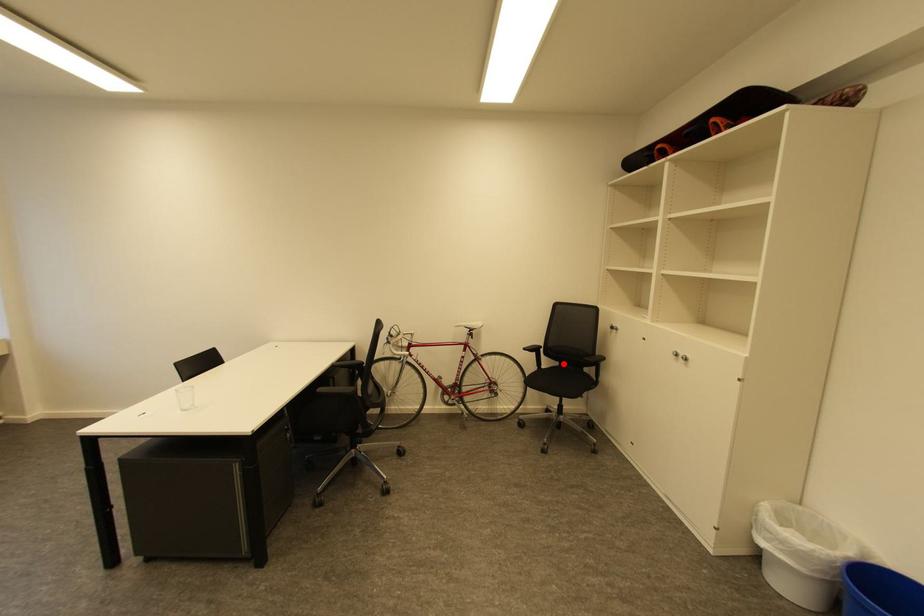
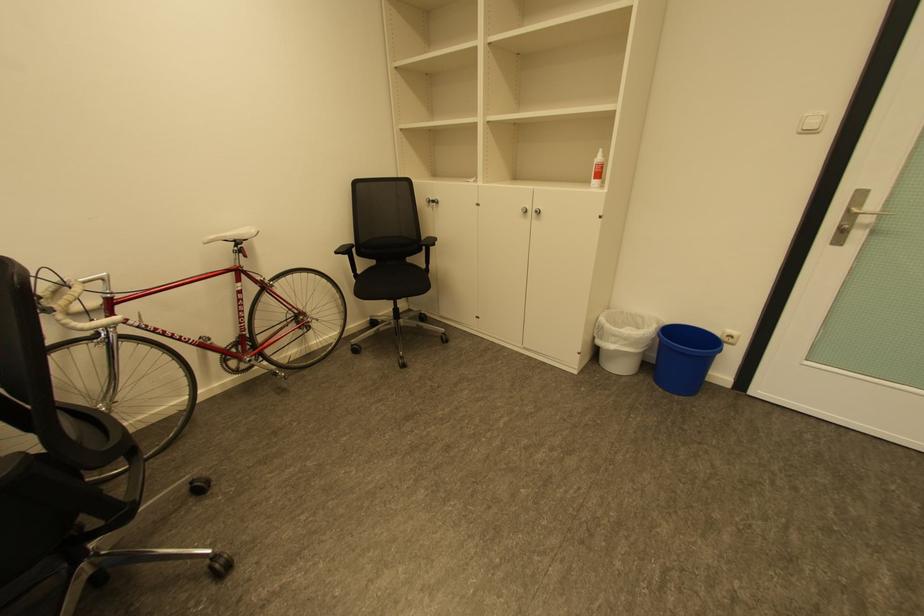
Where in the second image is the point corresponding to the highlighted location from the first image?

(380, 262)